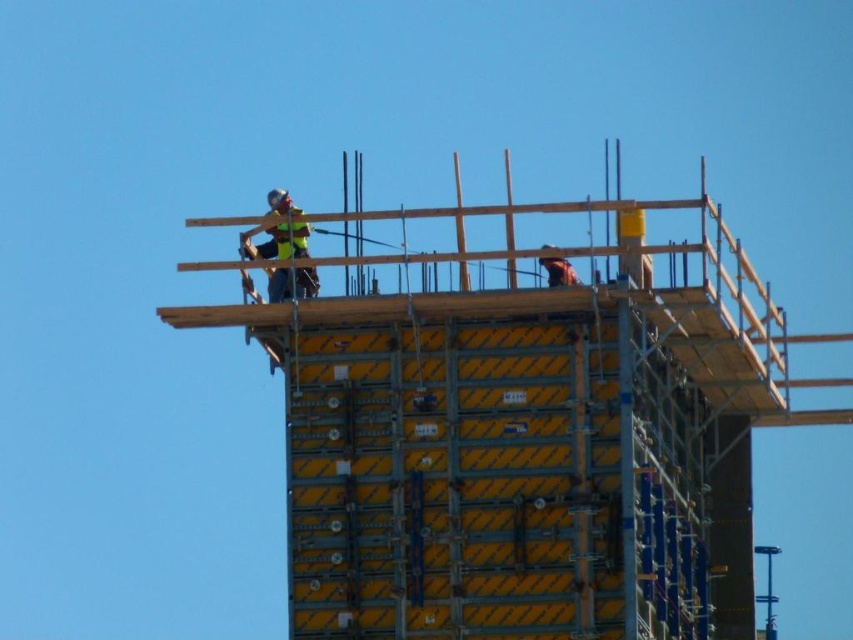
You are a construction worker standing at the lower level of the structure. You need to reach the yellow metallic scaffolding at upper center. Which direction should you move to reach it?

You should move upward to reach the yellow metallic scaffolding at upper center since it is located at a higher position than your current location.

You are a safety inspector observing the construction site. You notice two workers wearing yellow reflective vests. The first is labeled as a yellow reflective vest at upper center, and the second is labeled as a yellow reflective safety vest at upper center. Which worker is wearing a vest that is wider?

The yellow reflective vest at upper center might be wider than the yellow reflective safety vest at upper center.